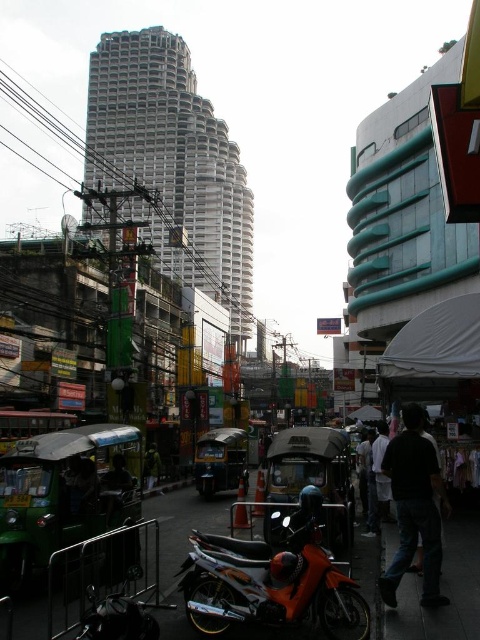
Question: Is dark matte clothing at lower right bigger than dark green tuk-tuk at center?

Choices:
 (A) yes
 (B) no

Answer: (A)

Question: Which of these objects is positioned closest to the orange matte motorcycle at lower center?

Choices:
 (A) dark green tuk-tuk at center
 (B) dark matte clothing at lower right

Answer: (B)

Question: Can you confirm if orange matte motorcycle at lower center is wider than dark matte clothing at lower right?

Choices:
 (A) yes
 (B) no

Answer: (A)

Question: Which point is farther to the camera?

Choices:
 (A) dark matte clothing at lower right
 (B) orange matte motorcycle at lower center
 (C) dark green tuk-tuk at center

Answer: (C)

Question: Considering the real-world distances, which object is closest to the dark green tuk-tuk at center?

Choices:
 (A) orange matte motorcycle at lower center
 (B) dark matte clothing at lower right

Answer: (A)

Question: Can you confirm if dark matte clothing at lower right is bigger than dark green tuk-tuk at center?

Choices:
 (A) yes
 (B) no

Answer: (A)